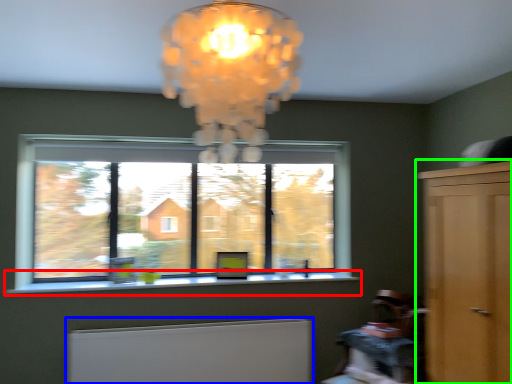
Question: Estimate the real-world distances between objects in this image. Which object is closer to window sill (highlighted by a red box), radiator (highlighted by a blue box) or dresser (highlighted by a green box)?

Choices:
 (A) radiator
 (B) dresser

Answer: (A)